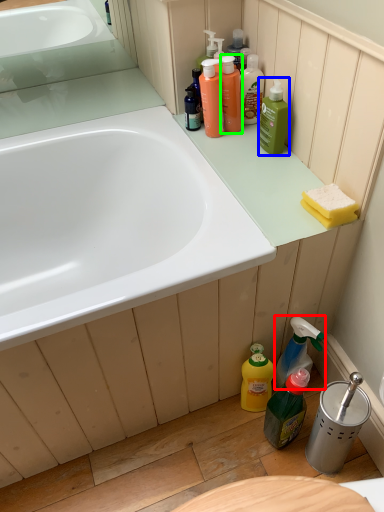
Question: Estimate the real-world distances between objects in this image. Which object is farther from cleaning product (highlighted by a red box), cleaning product (highlighted by a blue box) or mouthwash (highlighted by a green box)?

Choices:
 (A) cleaning product
 (B) mouthwash

Answer: (B)